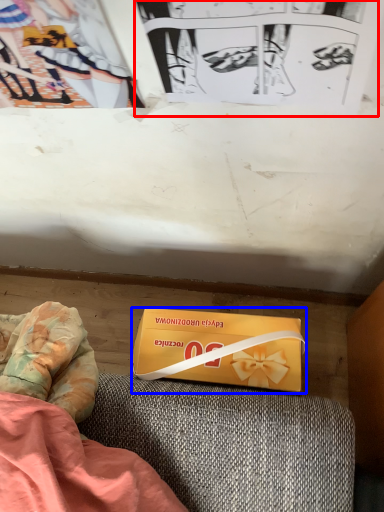
Question: Among these objects, which one is farthest to the camera, paperback book (highlighted by a red box) or box (highlighted by a blue box)?

Choices:
 (A) paperback book
 (B) box

Answer: (B)